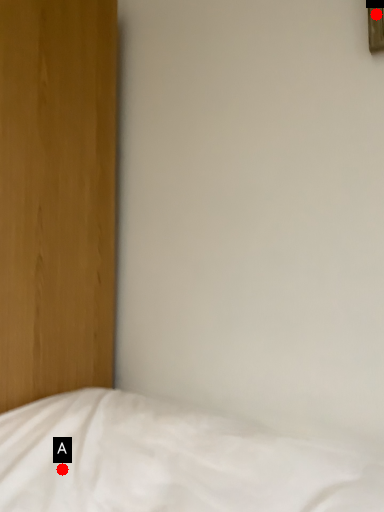
Question: Two points are circled on the image, labeled by A and B beside each circle. Which point is farther from the camera taking this photo?

Choices:
 (A) A is further
 (B) B is further

Answer: (B)